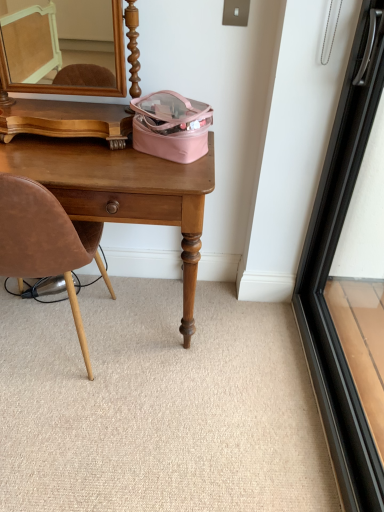
Where is `vacant area that is situated to the right of brown leather chair at left`? vacant area that is situated to the right of brown leather chair at left is located at coordinates (164, 382).